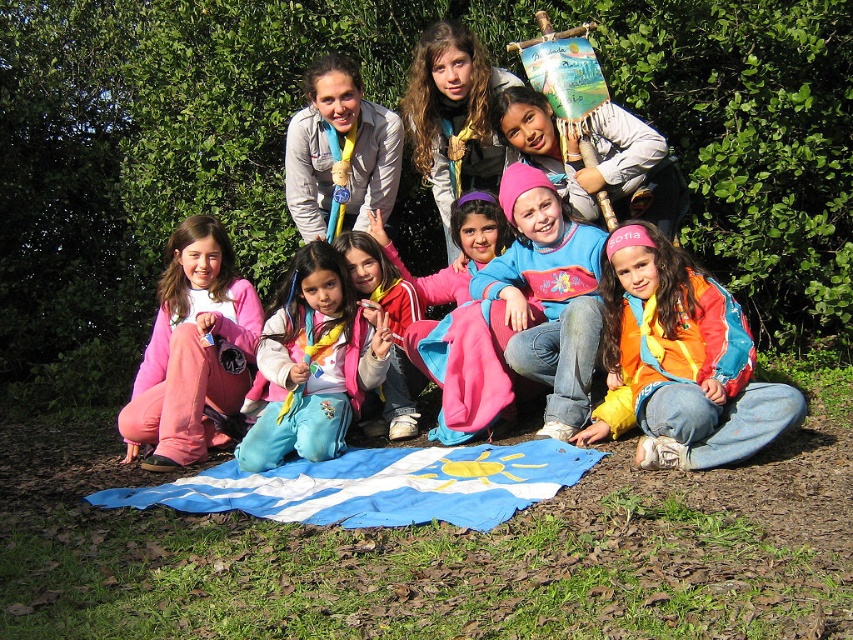
You are a photographer trying to capture a candid shot of the group. You notice the matte pink pants at center and the matte gray jacket at upper center. Which object should you focus on first if you want to capture both in the same frame without moving the camera?

You should focus on the matte gray jacket at upper center first because it is positioned higher than the matte pink pants at center, allowing both to be captured in the frame without needing to adjust the camera angle.

You are a member of the group and you want to show the flag to the group. Which object between the blue fabric flag at lower center and the matte gray jacket at upper center should you hold up higher to make sure everyone can see it clearly?

The blue fabric flag at lower center has a larger size compared to matte gray jacket at upper center, so you should hold it higher to ensure everyone can see it clearly.

You are a photographer trying to capture a group photo of the matte pink pants at center and the matte gray jacket at upper center. The camera lens has a maximum width capacity of 1.2 meters. Can you fit both objects within the frame without cropping either of them?

The matte pink pants at center might be wider than matte gray jacket at upper center, but since the exact width isn t specified, it s uncertain if they can fit within the 1.2 meter capacity. Further measurement is needed to confirm.